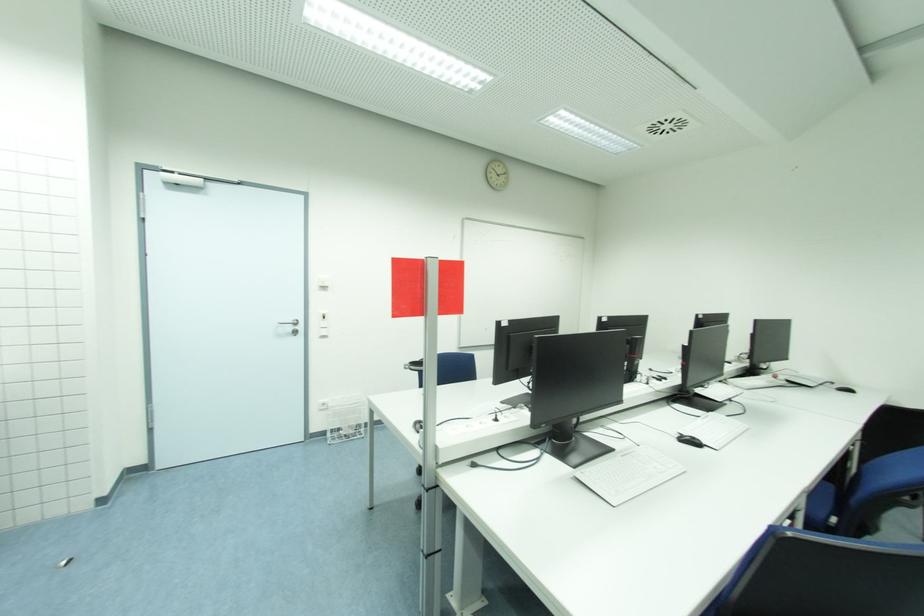
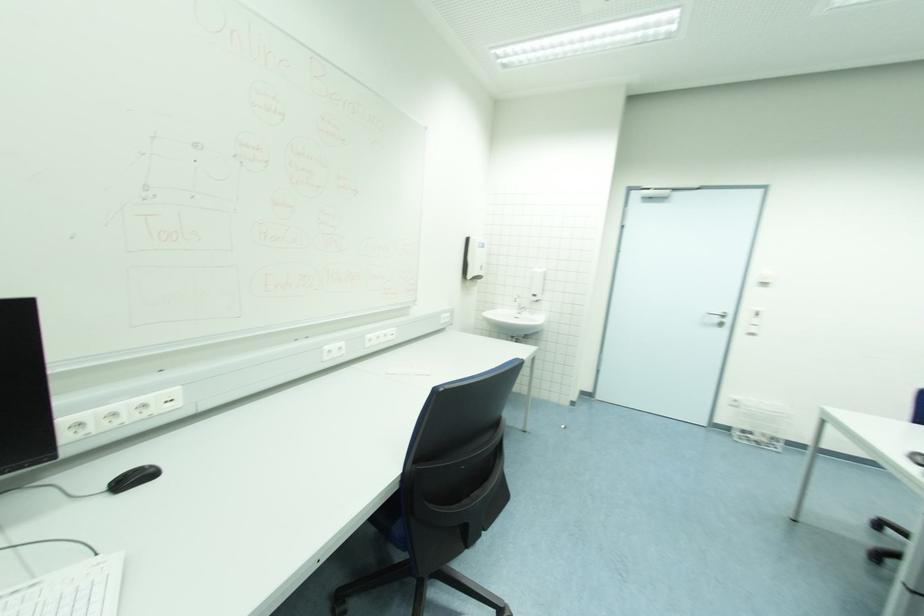
Question: How did the camera likely rotate?

Choices:
 (A) Left
 (B) Right
 (C) Up
 (D) Down

Answer: (A)